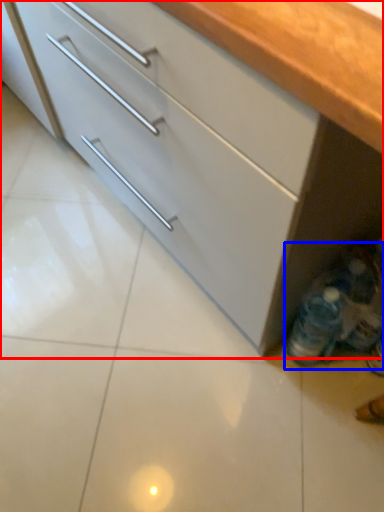
Question: Which object appears farthest to the camera in this image, cabinetry (highlighted by a red box) or bottle (highlighted by a blue box)?

Choices:
 (A) cabinetry
 (B) bottle

Answer: (B)